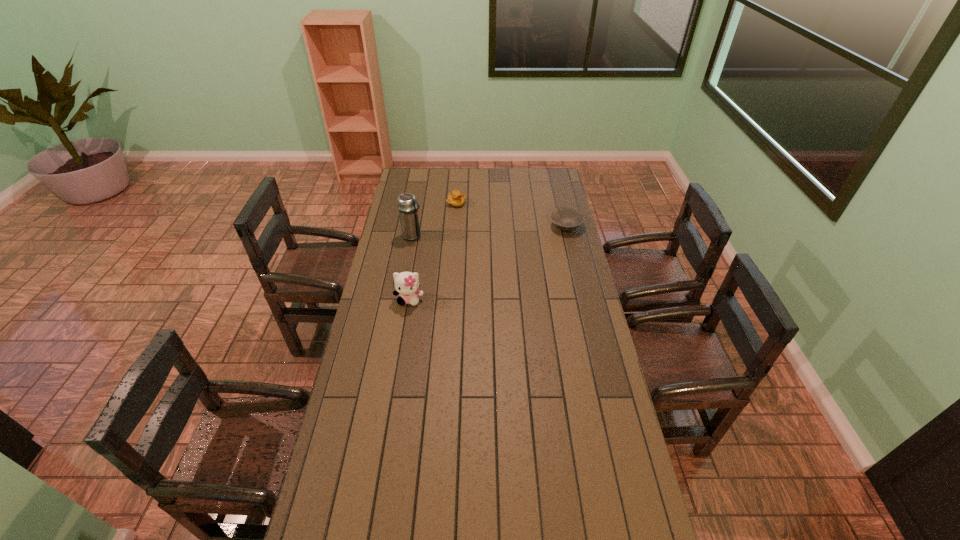
Image resolution: width=960 pixels, height=540 pixels. I want to click on vacant area situated at the beak of the duckling, so click(497, 251).

The image size is (960, 540). I want to click on vacant area situated at the beak of the duckling, so click(469, 218).

I want to click on vacant area located 0.250m with a handle on the side of the tallest object, so click(x=468, y=254).

Find the location of `free space located with a handle on the side of the tallest object`. free space located with a handle on the side of the tallest object is located at coordinates (433, 242).

The width and height of the screenshot is (960, 540). I want to click on vacant space located with a handle on the side of the tallest object, so click(x=440, y=245).

Identify the location of kitten that is at the left edge. The image size is (960, 540). (406, 284).

Locate an element on the screen. This screenshot has height=540, width=960. thermos bottle that is positioned at the left edge is located at coordinates (408, 210).

The image size is (960, 540). Find the location of `object present at the right edge`. object present at the right edge is located at coordinates (565, 218).

Find the location of `free location at the far edge`. free location at the far edge is located at coordinates (491, 187).

Find the location of a particular element. blank space at the left edge is located at coordinates (393, 282).